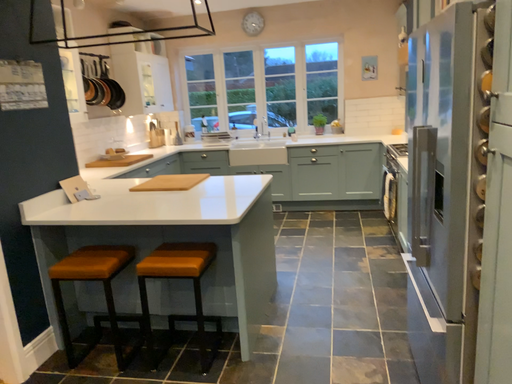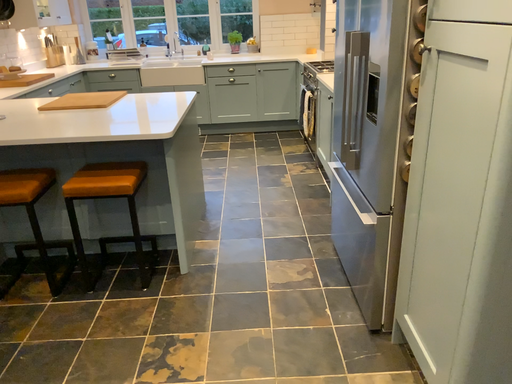
Question: Which way did the camera rotate in the video?

Choices:
 (A) rotated downward
 (B) rotated upward

Answer: (A)